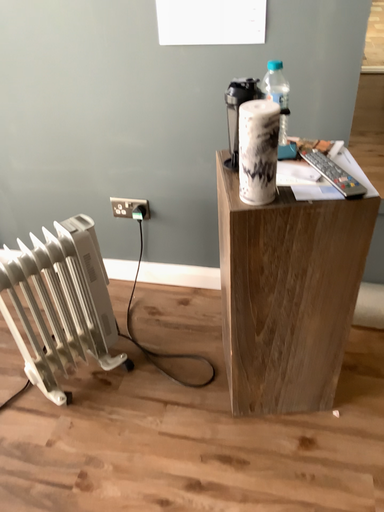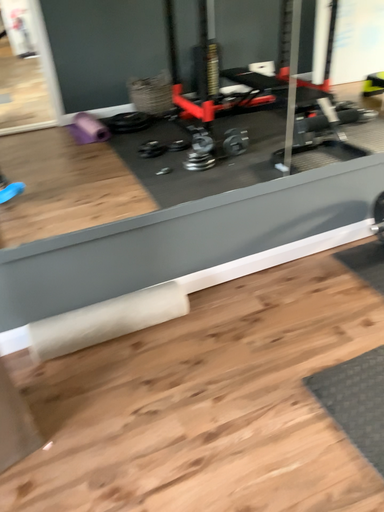
Question: Which way did the camera rotate in the video?

Choices:
 (A) rotated upward
 (B) rotated downward

Answer: (A)